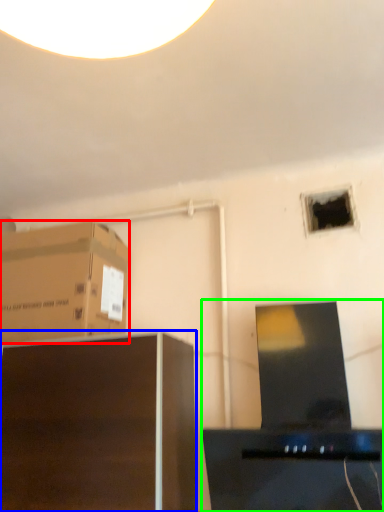
Question: Estimate the real-world distances between objects in this image. Which object is farther from cardboard box (highlighted by a red box), furniture (highlighted by a blue box) or desktop computer (highlighted by a green box)?

Choices:
 (A) furniture
 (B) desktop computer

Answer: (B)